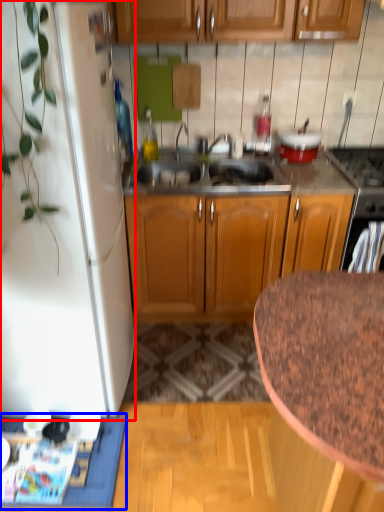
Question: Which object is further to the camera taking this photo, refrigerator (highlighted by a red box) or doormat (highlighted by a blue box)?

Choices:
 (A) refrigerator
 (B) doormat

Answer: (B)